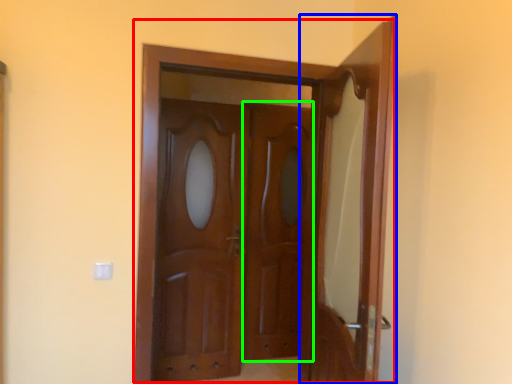
Question: Considering the real-world distances, which object is closest to door (highlighted by a red box)? door (highlighted by a blue box) or screen door (highlighted by a green box).

Choices:
 (A) door
 (B) screen door

Answer: (A)